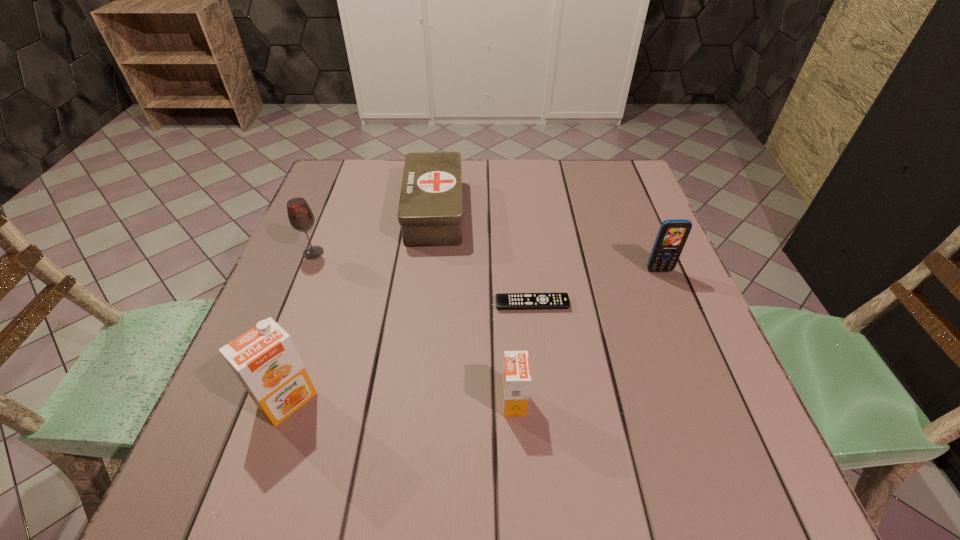
The width and height of the screenshot is (960, 540). I want to click on blank space that satisfies the following two spatial constraints: 1. on the front side of the third nearest object; 2. on the right side of the glass drink container, so click(293, 304).